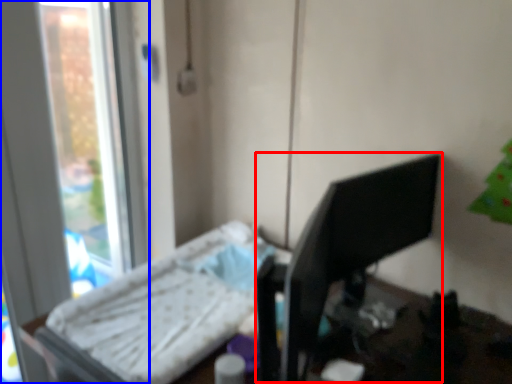
Question: Which object is closer to the camera taking this photo, desktop computer (highlighted by a red box) or window (highlighted by a blue box)?

Choices:
 (A) desktop computer
 (B) window

Answer: (A)